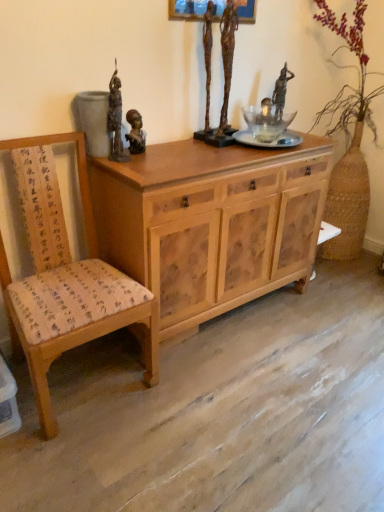
The image size is (384, 512). What are the coordinates of `free location in front of braided straw vase at right` in the screenshot? It's located at (336, 297).